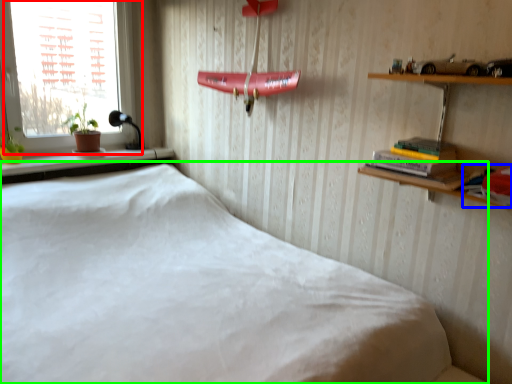
Question: Which object is positioned farthest from window (highlighted by a red box)? Select from book (highlighted by a blue box) and bed (highlighted by a green box).

Choices:
 (A) book
 (B) bed

Answer: (A)